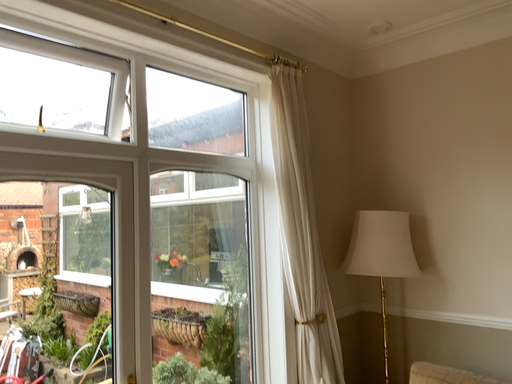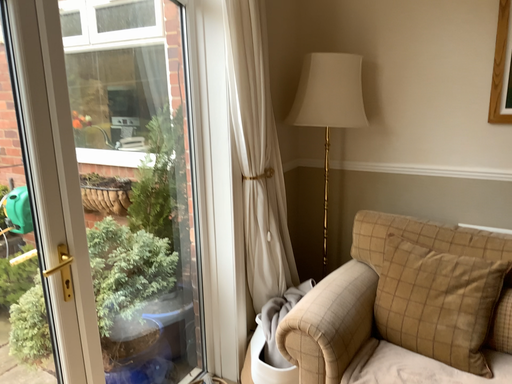
Question: Which way did the camera rotate in the video?

Choices:
 (A) rotated upward
 (B) rotated downward

Answer: (B)